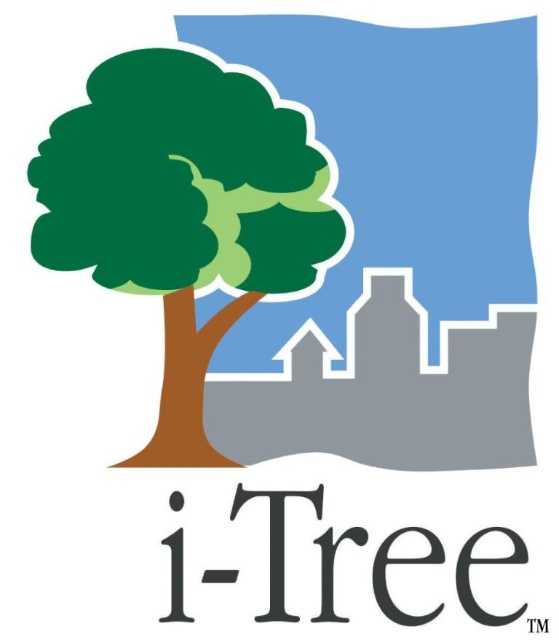
Who is shorter, green matte tree at center or black glossy i-tree at center?

Standing shorter between the two is black glossy i-tree at center.

Is point (168, 134) less distant than point (528, 618)?

No, it is behind (528, 618).

Is point (255, 184) in front of point (532, 628)?

No, (255, 184) is behind (532, 628).

This screenshot has height=640, width=559. I want to click on green matte tree at center, so (183, 211).

Does black matte i-tree at center have a smaller size compared to black glossy i-tree at center?

No.

Is black matte i-tree at center taller than black glossy i-tree at center?

Yes.

Is point (466, 595) closer to camera compared to point (542, 625)?

No.

This screenshot has height=640, width=559. I want to click on black matte i-tree at center, so 277,541.

Looking at this image, does green matte tree at center appear on the left side of black matte i-tree at center?

Correct, you'll find green matte tree at center to the left of black matte i-tree at center.

Does point (333, 221) lie in front of point (408, 525)?

No, (333, 221) is behind (408, 525).

Does point (262, 166) come farther from viewer compared to point (203, 572)?

Yes, point (262, 166) is farther from viewer.

This screenshot has width=559, height=640. What are the coordinates of `green matte tree at center` in the screenshot? It's located at (183, 211).